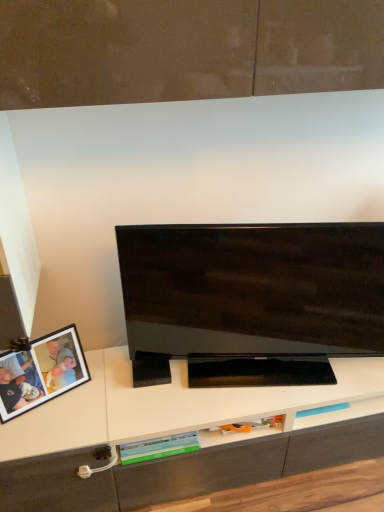
Question: Is the depth of glossy black tv at center greater than that of matte black photo frame at lower left?

Choices:
 (A) yes
 (B) no

Answer: (B)

Question: Considering the relative sizes of glossy black tv at center and matte black photo frame at lower left in the image provided, is glossy black tv at center wider than matte black photo frame at lower left?

Choices:
 (A) yes
 (B) no

Answer: (A)

Question: Considering the relative sizes of glossy black tv at center and matte black photo frame at lower left in the image provided, is glossy black tv at center shorter than matte black photo frame at lower left?

Choices:
 (A) no
 (B) yes

Answer: (A)

Question: From the image's perspective, is glossy black tv at center on top of matte black photo frame at lower left?

Choices:
 (A) yes
 (B) no

Answer: (A)

Question: Considering the relative positions of glossy black tv at center and matte black photo frame at lower left in the image provided, is glossy black tv at center to the right of matte black photo frame at lower left from the viewer's perspective?

Choices:
 (A) no
 (B) yes

Answer: (B)

Question: Considering the relative sizes of glossy black tv at center and matte black photo frame at lower left in the image provided, is glossy black tv at center taller than matte black photo frame at lower left?

Choices:
 (A) yes
 (B) no

Answer: (A)

Question: From a real-world perspective, is matte black photo frame at lower left physically below glossy black tv at center?

Choices:
 (A) yes
 (B) no

Answer: (A)

Question: Considering the relative sizes of matte black photo frame at lower left and glossy black tv at center in the image provided, is matte black photo frame at lower left thinner than glossy black tv at center?

Choices:
 (A) yes
 (B) no

Answer: (A)

Question: Is matte black photo frame at lower left turned away from glossy black tv at center?

Choices:
 (A) yes
 (B) no

Answer: (B)

Question: Does matte black photo frame at lower left contain glossy black tv at center?

Choices:
 (A) no
 (B) yes

Answer: (A)

Question: Can you confirm if matte black photo frame at lower left is positioned to the left of glossy black tv at center?

Choices:
 (A) yes
 (B) no

Answer: (A)

Question: Is matte black photo frame at lower left bigger than glossy black tv at center?

Choices:
 (A) yes
 (B) no

Answer: (B)

Question: In terms of width, does glossy black tv at center look wider or thinner when compared to matte black photo frame at lower left?

Choices:
 (A) thin
 (B) wide

Answer: (B)